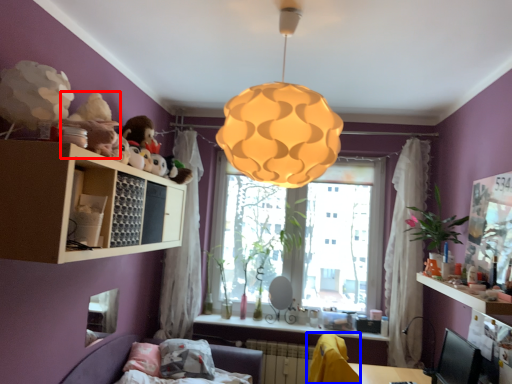
Question: Which of the following is the farthest to the observer, toy (highlighted by a red box) or swivel chair (highlighted by a blue box)?

Choices:
 (A) toy
 (B) swivel chair

Answer: (B)